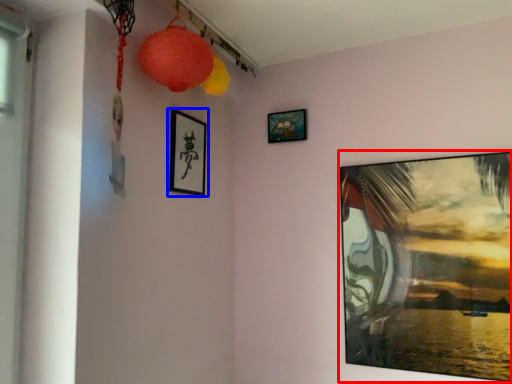
Question: Which object appears farthest to the camera in this image, picture frame (highlighted by a red box) or picture frame (highlighted by a blue box)?

Choices:
 (A) picture frame
 (B) picture frame

Answer: (B)